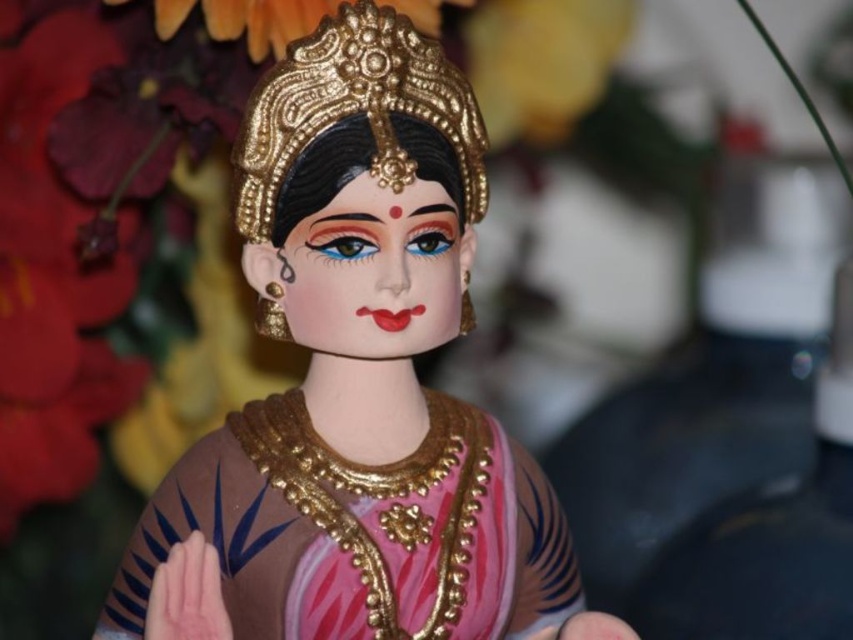
What is the location of the point with coordinates (360, 376) in relation to the objects in the scene?

The point with coordinates (360, 376) is located on the matte gold statue at center.

Based on the coordinates provided in the Objects Description, where is the matte gold statue at center located in the image?

The matte gold statue at center is located at point coordinates of (360, 376).